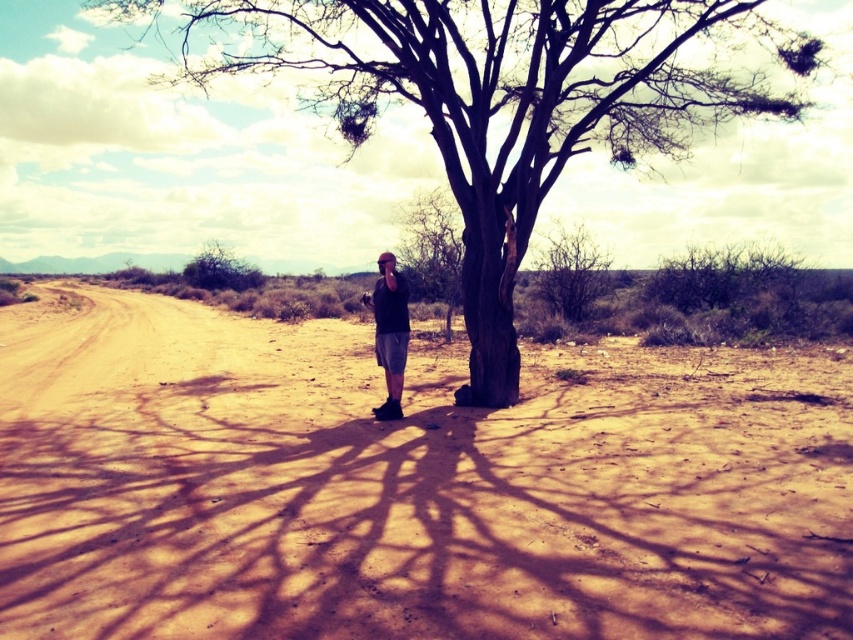
Question: Which object is farther from the camera taking this photo?

Choices:
 (A) bare wood tree at center
 (B) green leafy bush at upper left

Answer: (B)

Question: Estimate the real-world distances between objects in this image. Which object is farther from the matte black shirt at center?

Choices:
 (A) bare wood tree at center
 (B) brown sandy dirt at center
 (C) green leafy bush at upper left

Answer: (C)

Question: Can you confirm if brown sandy dirt at center is thinner than bare wood tree at center?

Choices:
 (A) yes
 (B) no

Answer: (B)

Question: Is bare wood tree at center smaller than green leafy bush at upper left?

Choices:
 (A) no
 (B) yes

Answer: (B)

Question: Estimate the real-world distances between objects in this image. Which object is closer to the green leafy bush at upper left?

Choices:
 (A) bare wood tree at center
 (B) brown sandy dirt at center

Answer: (A)

Question: Is brown sandy dirt at center closer to camera compared to brown rough bark tree at center?

Choices:
 (A) yes
 (B) no

Answer: (A)